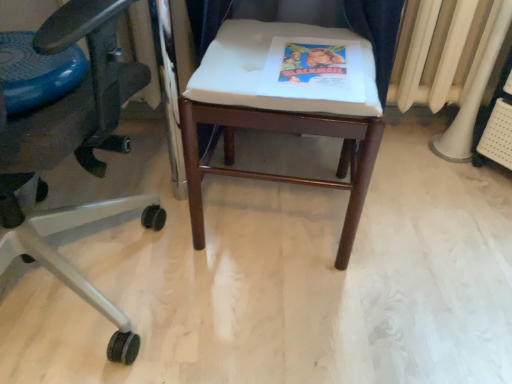
Locate an element on the screen. free spot to the right of white fabric stool at center is located at coordinates (422, 221).